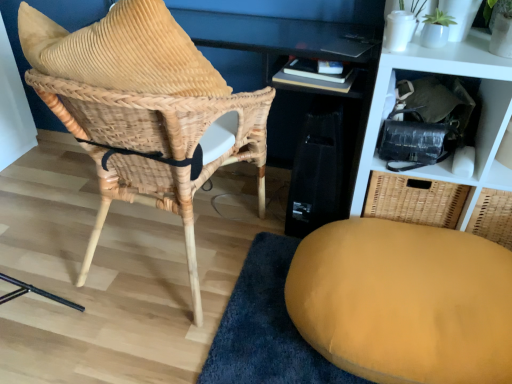
Image resolution: width=512 pixels, height=384 pixels. In order to click on vacant space in woven rattan chair at left (from a real-world perspective) in this screenshot , I will do `click(175, 246)`.